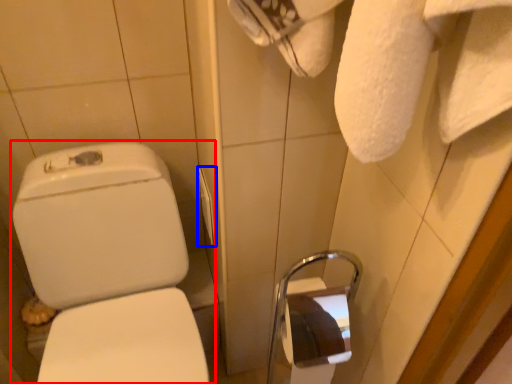
Question: Which point is further to the camera, toilet (highlighted by a red box) or towel bar (highlighted by a blue box)?

Choices:
 (A) toilet
 (B) towel bar

Answer: (B)